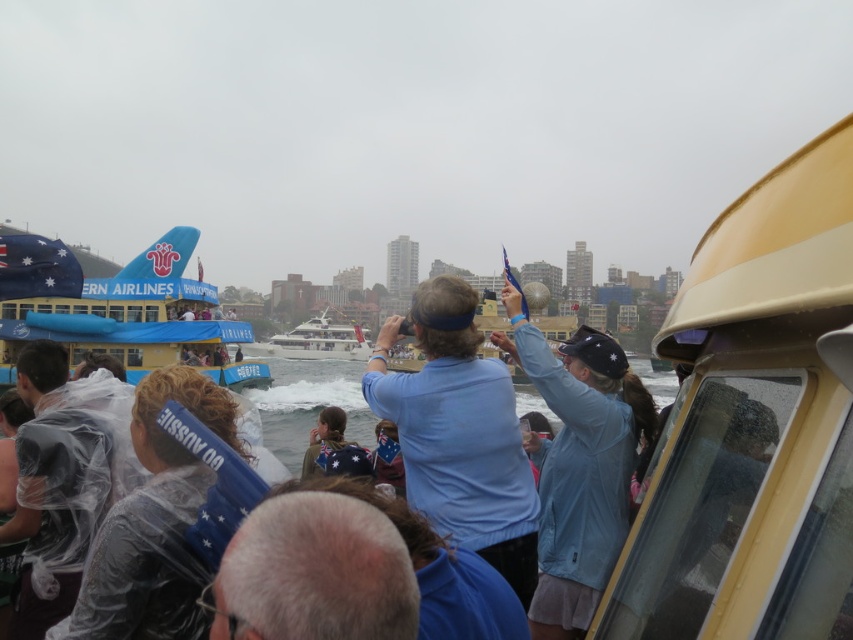
Between light blue fabric at center and white glossy yacht at center, which one has more height?

light blue fabric at center is taller.

Can you confirm if light blue fabric at center is bigger than white glossy yacht at center?

Actually, light blue fabric at center might be smaller than white glossy yacht at center.

What do you see at coordinates (578, 465) in the screenshot? This screenshot has width=853, height=640. I see `light blue fabric at center` at bounding box center [578, 465].

The height and width of the screenshot is (640, 853). I want to click on light blue fabric at center, so click(578, 465).

Between blue fabric boat at upper left and white glossy yacht at center, which one is positioned higher?

blue fabric boat at upper left

In the scene shown: Which is more to the right, blue fabric boat at upper left or white glossy yacht at center?

white glossy yacht at center

This screenshot has width=853, height=640. What do you see at coordinates (137, 317) in the screenshot?
I see `blue fabric boat at upper left` at bounding box center [137, 317].

Locate an element on the screen. blue fabric boat at upper left is located at coordinates (137, 317).

Does light blue fabric at center come in front of blue fabric boat at upper left?

Yes, light blue fabric at center is in front of blue fabric boat at upper left.

Who is lower down, light blue fabric at center or blue fabric boat at upper left?

light blue fabric at center is lower down.

This screenshot has width=853, height=640. Describe the element at coordinates (578, 465) in the screenshot. I see `light blue fabric at center` at that location.

Locate an element on the screen. The width and height of the screenshot is (853, 640). light blue fabric at center is located at coordinates (578, 465).